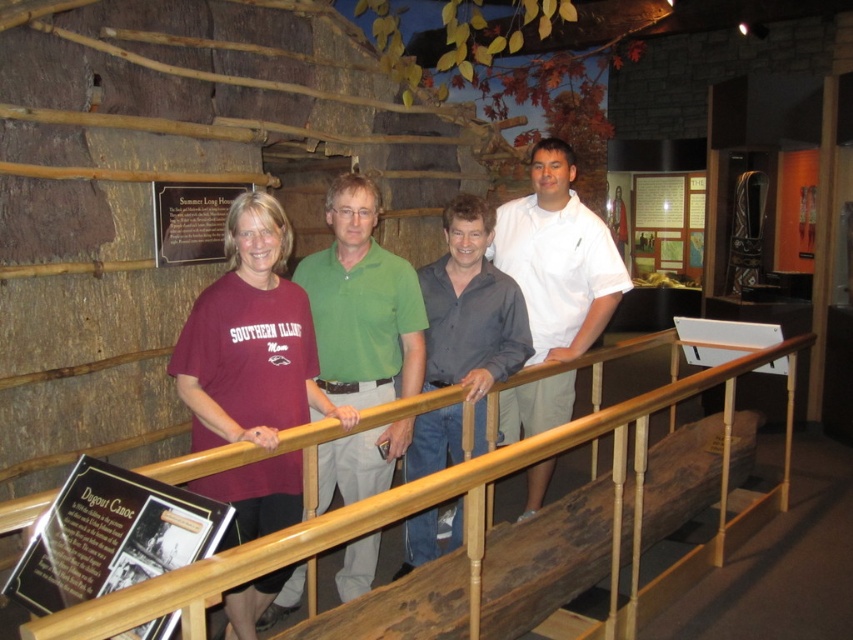
Is maroon t-shirt at center taller than green cotton shirt at center?

No.

Does maroon t-shirt at center appear over green cotton shirt at center?

Incorrect, maroon t-shirt at center is not positioned above green cotton shirt at center.

This screenshot has width=853, height=640. Identify the location of maroon t-shirt at center. 250,339.

Does brown polished wood rail at center appear on the left side of black plastic sign at lower left?

In fact, brown polished wood rail at center is to the right of black plastic sign at lower left.

Measure the distance between brown polished wood rail at center and black plastic sign at lower left.

Answer: A distance of 14.56 inches exists between brown polished wood rail at center and black plastic sign at lower left.

Locate an element on the screen. brown polished wood rail at center is located at coordinates (254, 552).

Locate an element on the screen. This screenshot has height=640, width=853. brown polished wood rail at center is located at coordinates tap(254, 552).

What do you see at coordinates (111, 536) in the screenshot? I see `black plastic sign at lower left` at bounding box center [111, 536].

Is black plastic sign at lower left positioned in front of dark gray shirt at center?

Yes, black plastic sign at lower left is in front of dark gray shirt at center.

Describe the element at coordinates (111, 536) in the screenshot. I see `black plastic sign at lower left` at that location.

Identify the location of black plastic sign at lower left. The height and width of the screenshot is (640, 853). (111, 536).